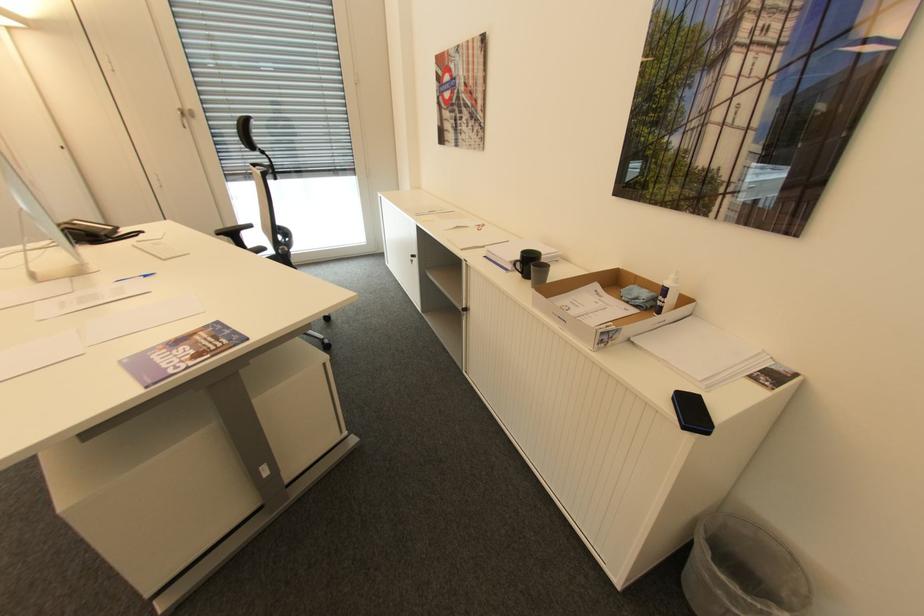
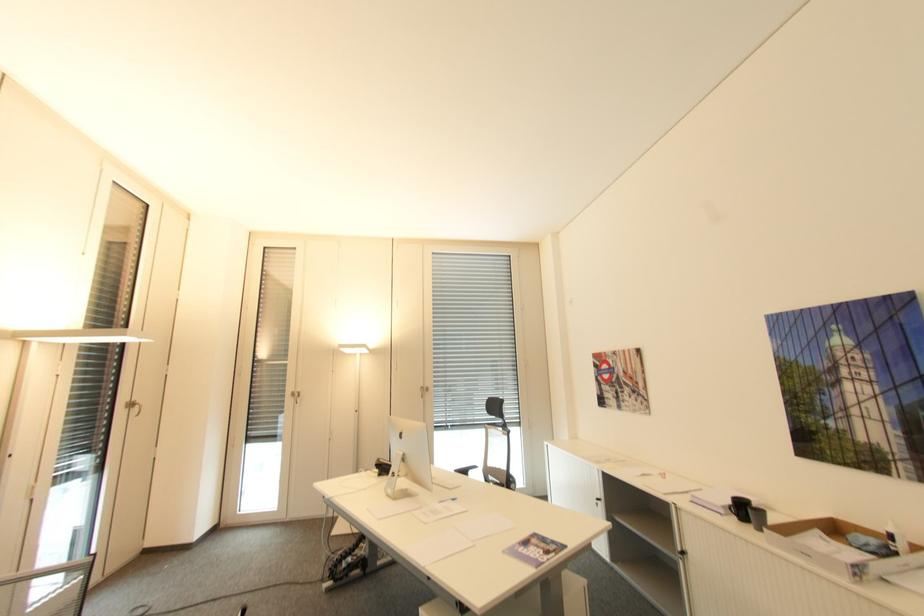
The point at (524, 256) is marked in the first image. Where is the corresponding point in the second image?

(734, 501)